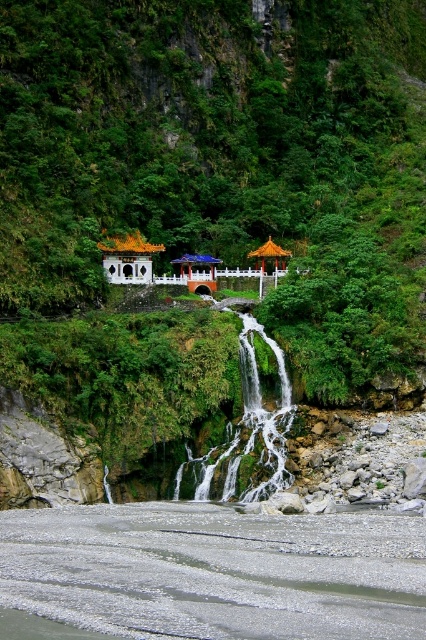
Is point (282, 529) in front of point (103, 244)?

Yes, point (282, 529) is closer to viewer.

Identify the location of gray gravel river at lower center. This screenshot has height=640, width=426. (216, 572).

Does point (72, 513) lie behind point (285, 416)?

No, it is not.

Can you confirm if gray gravel river at lower center is positioned above green mossy waterfall at center?

No, gray gravel river at lower center is not above green mossy waterfall at center.

The height and width of the screenshot is (640, 426). I want to click on gray gravel river at lower center, so click(216, 572).

Where is `gray gravel river at lower center`? gray gravel river at lower center is located at coordinates (216, 572).

Which is in front, point (43, 528) or point (187, 268)?

Point (43, 528)

Does gray gravel river at lower center appear under matte orange gazebo at center?

Yes, gray gravel river at lower center is below matte orange gazebo at center.

Is point (183, 516) less distant than point (195, 253)?

That is True.

This screenshot has width=426, height=640. Find the location of `gray gravel river at lower center`. gray gravel river at lower center is located at coordinates (216, 572).